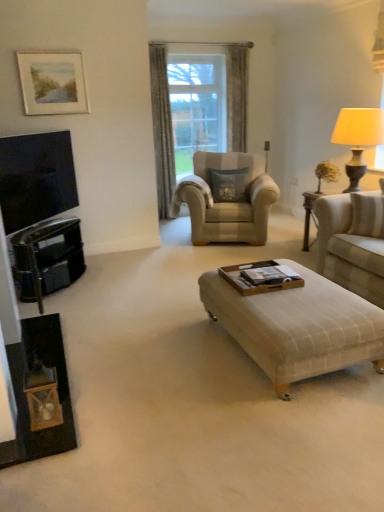
Question: Is beige fabric couch at right taller than black glossy dresser at left?

Choices:
 (A) yes
 (B) no

Answer: (A)

Question: Does beige fabric couch at right have a lesser height compared to black glossy dresser at left?

Choices:
 (A) no
 (B) yes

Answer: (A)

Question: From the image's perspective, would you say beige fabric couch at right is shown under black glossy dresser at left?

Choices:
 (A) yes
 (B) no

Answer: (B)

Question: Considering the relative sizes of beige fabric couch at right and black glossy dresser at left in the image provided, is beige fabric couch at right wider than black glossy dresser at left?

Choices:
 (A) yes
 (B) no

Answer: (A)

Question: Is beige fabric couch at right aimed at black glossy dresser at left?

Choices:
 (A) yes
 (B) no

Answer: (A)

Question: Is point (246, 173) positioned closer to the camera than point (220, 218)?

Choices:
 (A) closer
 (B) farther

Answer: (B)

Question: From the image's perspective, is suede gray pillow at center above or below beige fabric armchair at center?

Choices:
 (A) below
 (B) above

Answer: (B)

Question: Relative to beige fabric armchair at center, is suede gray pillow at center in front or behind?

Choices:
 (A) behind
 (B) front

Answer: (A)

Question: Considering the relative positions of suede gray pillow at center and beige fabric armchair at center in the image provided, is suede gray pillow at center to the left or to the right of beige fabric armchair at center?

Choices:
 (A) right
 (B) left

Answer: (A)

Question: Is point (77, 238) positioned closer to the camera than point (243, 226)?

Choices:
 (A) farther
 (B) closer

Answer: (B)

Question: In terms of width, does black glossy dresser at left look wider or thinner when compared to beige fabric armchair at center?

Choices:
 (A) thin
 (B) wide

Answer: (A)

Question: Looking at the image, does black glossy dresser at left seem bigger or smaller compared to beige fabric armchair at center?

Choices:
 (A) big
 (B) small

Answer: (B)

Question: From the image's perspective, is black glossy dresser at left above or below beige fabric armchair at center?

Choices:
 (A) above
 (B) below

Answer: (B)

Question: Do you think gray textured curtain at center is within beige fabric couch at right, or outside of it?

Choices:
 (A) outside
 (B) inside

Answer: (A)

Question: In terms of size, does gray textured curtain at center appear bigger or smaller than beige fabric couch at right?

Choices:
 (A) big
 (B) small

Answer: (B)